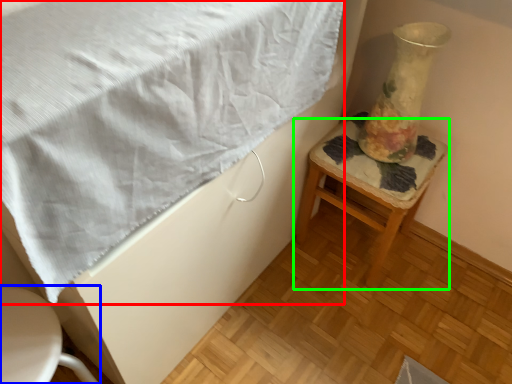
Question: Estimate the real-world distances between objects in this image. Which object is farther from blanket (highlighted by a red box), furniture (highlighted by a blue box) or stool (highlighted by a green box)?

Choices:
 (A) furniture
 (B) stool

Answer: (B)